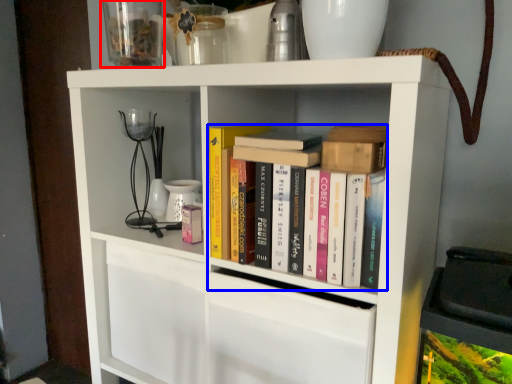
Question: Among these objects, which one is nearest to the camera, glass vase (highlighted by a red box) or book (highlighted by a blue box)?

Choices:
 (A) glass vase
 (B) book

Answer: (B)